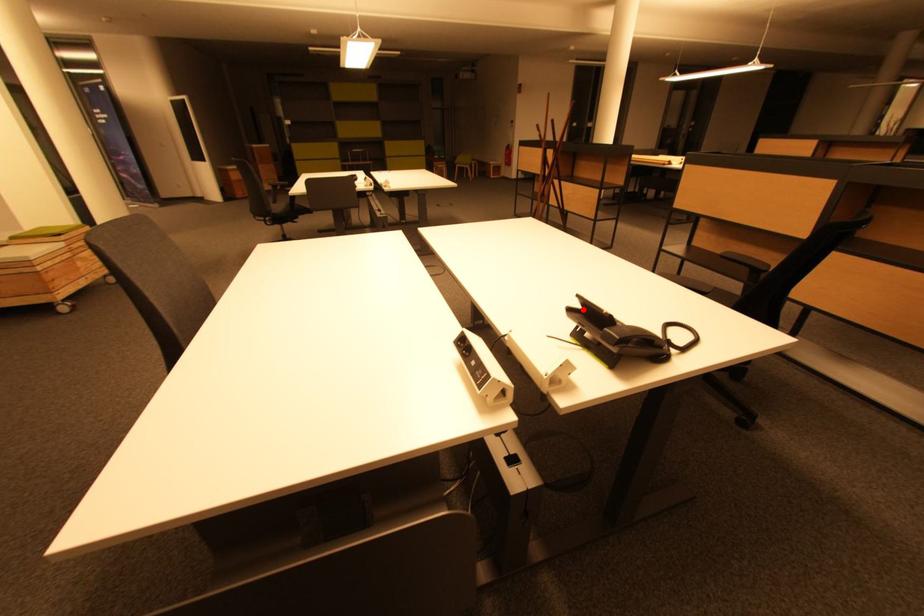
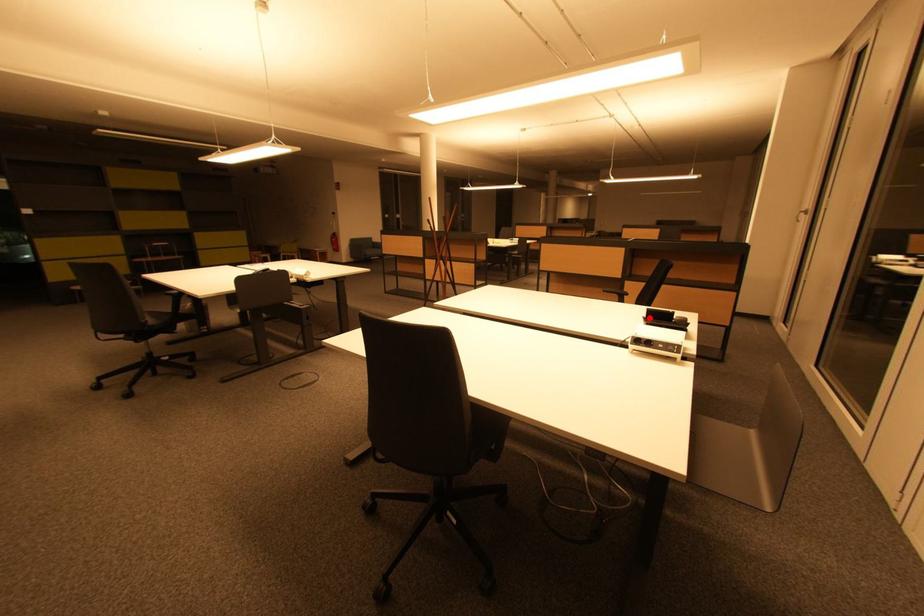
I am providing you with two images of the same scene from different viewpoints. A red point is marked on the first image and another point is marked on the second image. Do the highlighted points in image1 and image2 indicate the same real-world spot?

Yes